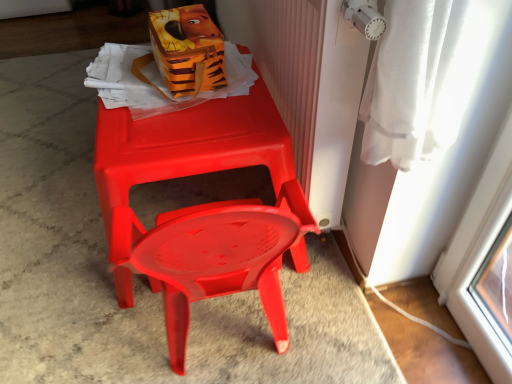
Identify the location of orange fabric lunch box at upper center. This screenshot has width=512, height=384. (188, 50).

Does point (262, 77) come in front of point (110, 150)?

That is False.

From the image's perspective, which one is positioned higher, white textured radiator at upper right or matte plastic chair at center?

From the image's view, white textured radiator at upper right is above.

From the picture: Considering the sizes of white textured radiator at upper right and matte plastic chair at center in the image, is white textured radiator at upper right wider or thinner than matte plastic chair at center?

In the image, white textured radiator at upper right appears to be more narrow than matte plastic chair at center.

Find the location of a particular element. This screenshot has height=384, width=512. chair in front of the orange fabric lunch box at upper center is located at coordinates (183, 153).

Which object is thinner, orange fabric lunch box at upper center or matte plastic chair at center?

With smaller width is orange fabric lunch box at upper center.

Is orange fabric lunch box at upper center surrounding matte plastic chair at center?

That's incorrect, matte plastic chair at center is not inside orange fabric lunch box at upper center.

The height and width of the screenshot is (384, 512). I want to click on lunch box located on the left of white textured radiator at upper right, so click(x=188, y=50).

Is the position of orange fabric lunch box at upper center more distant than that of white textured radiator at upper right?

Yes, the depth of orange fabric lunch box at upper center is greater than that of white textured radiator at upper right.

Would you say orange fabric lunch box at upper center is outside white textured radiator at upper right?

Indeed, orange fabric lunch box at upper center is completely outside white textured radiator at upper right.

What's the angular difference between matte plastic chair at center and white textured radiator at upper right's facing directions?

The angle between the facing direction of matte plastic chair at center and the facing direction of white textured radiator at upper right is 0.222 degrees.

Is matte plastic chair at center wider than white textured radiator at upper right?

Correct, the width of matte plastic chair at center exceeds that of white textured radiator at upper right.

Is point (250, 131) behind point (260, 52)?

No, (250, 131) is in front of (260, 52).

From a real-world perspective, is matte plastic chair at center positioned under white textured radiator at upper right based on gravity?

Indeed, from a real-world perspective, matte plastic chair at center is positioned beneath white textured radiator at upper right.

Which of these two, matte plastic chair at center or orange fabric lunch box at upper center, is smaller?

orange fabric lunch box at upper center is smaller.

Is matte plastic chair at center facing away from orange fabric lunch box at upper center?

No, matte plastic chair at center's orientation is not away from orange fabric lunch box at upper center.

Are matte plastic chair at center and orange fabric lunch box at upper center beside each other?

matte plastic chair at center is not next to orange fabric lunch box at upper center, and they're not touching.

Considering the positions of objects matte plastic chair at center and orange fabric lunch box at upper center in the image provided, who is behind, matte plastic chair at center or orange fabric lunch box at upper center?

Positioned behind is orange fabric lunch box at upper center.

In the image, is white textured radiator at upper right on the left side or the right side of orange fabric lunch box at upper center?

From the image, it's evident that white textured radiator at upper right is to the right of orange fabric lunch box at upper center.

Is point (301, 7) farther from camera compared to point (177, 88)?

No, it is in front of (177, 88).

Is white textured radiator at upper right positioned beyond the bounds of orange fabric lunch box at upper center?

white textured radiator at upper right lies outside orange fabric lunch box at upper center's area.

Where is `radiator on the right of matte plastic chair at center`? This screenshot has height=384, width=512. radiator on the right of matte plastic chair at center is located at coordinates (284, 61).

Find the location of a particular element. lunch box behind the matte plastic chair at center is located at coordinates (188, 50).

Based on their spatial positions, is matte plastic chair at center or white textured radiator at upper right further from orange fabric lunch box at upper center?

white textured radiator at upper right is positioned further to the anchor orange fabric lunch box at upper center.

Considering their positions, is matte plastic chair at center positioned closer to white textured radiator at upper right than orange fabric lunch box at upper center?

Based on the image, matte plastic chair at center appears to be nearer to white textured radiator at upper right.

Estimate the real-world distances between objects in this image. Which object is closer to orange fabric lunch box at upper center, white textured radiator at upper right or matte plastic chair at center?

matte plastic chair at center is positioned closer to the anchor orange fabric lunch box at upper center.

Looking at the image, which one is located further to white textured radiator at upper right, orange fabric lunch box at upper center or matte plastic chair at center?

Based on the image, orange fabric lunch box at upper center appears to be further to white textured radiator at upper right.

Which object lies further to the anchor point matte plastic chair at center, orange fabric lunch box at upper center or white textured radiator at upper right?

white textured radiator at upper right is positioned further to the anchor matte plastic chair at center.

From the image, which object appears to be nearer to matte plastic chair at center, white textured radiator at upper right or orange fabric lunch box at upper center?

orange fabric lunch box at upper center is positioned closer to the anchor matte plastic chair at center.

In order to click on lunch box that lies between white textured radiator at upper right and matte plastic chair at center from top to bottom in this screenshot , I will do `click(188, 50)`.